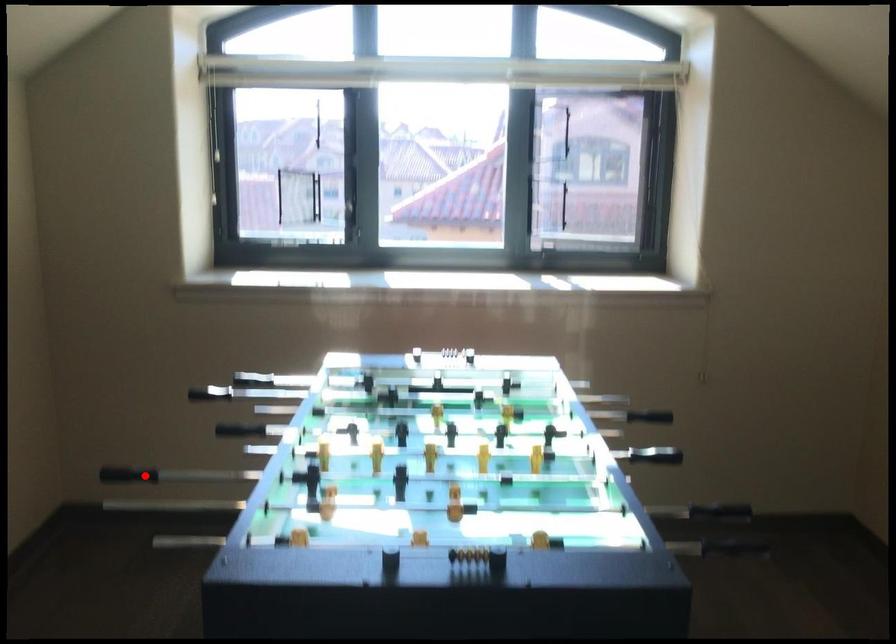
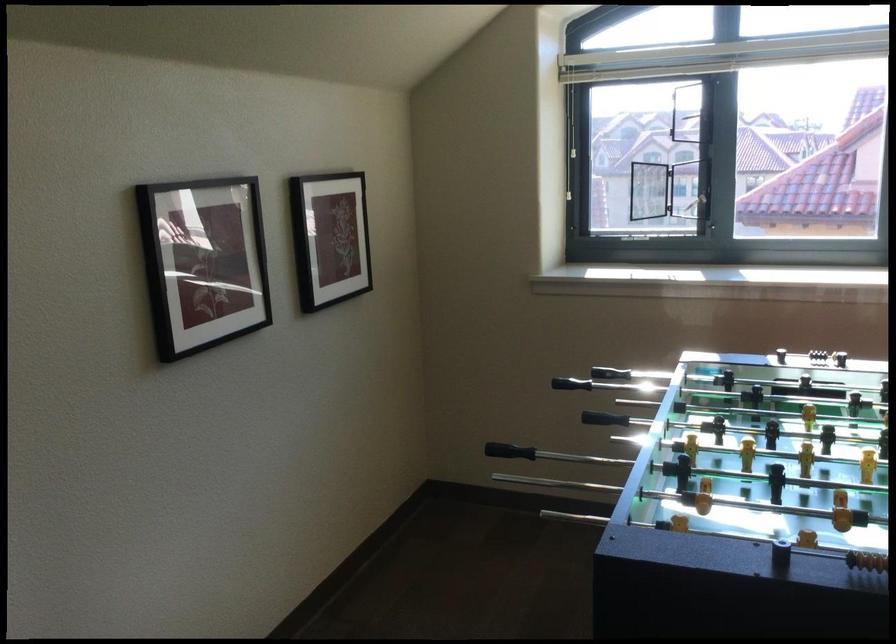
Locate, in the second image, the point that corresponds to the highlighted location in the first image.

(509, 451)